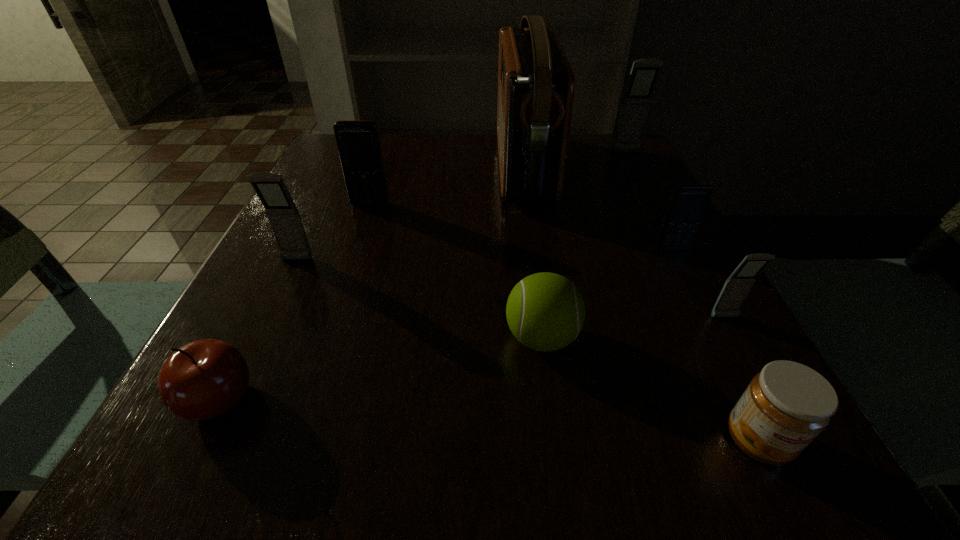
Point out which cellular telephone is positioned as the second nearest to the tennis ball. Please provide its 2D coordinates. Your answer should be formatted as a tuple, i.e. [(x, y)], where the tuple contains the x and y coordinates of a point satisfying the conditions above.

[(688, 202)]

This screenshot has width=960, height=540. I want to click on cellular telephone that can be found as the closest to the nearest cellular telephone, so click(688, 202).

Point out which gray cellular telephone is positioned as the nearest to the leftmost cellular telephone. Please provide its 2D coordinates. Your answer should be formatted as a tuple, i.e. [(x, y)], where the tuple contains the x and y coordinates of a point satisfying the conditions above.

[(736, 288)]

Where is `gray cellular telephone identified as the second closest to the leftmost cellular telephone`? The width and height of the screenshot is (960, 540). gray cellular telephone identified as the second closest to the leftmost cellular telephone is located at coordinates (644, 74).

This screenshot has height=540, width=960. What are the coordinates of `vacant point that satisfies the following two spatial constraints: 1. on the back side of the apple; 2. on the right side of the tennis ball` in the screenshot? It's located at 251,338.